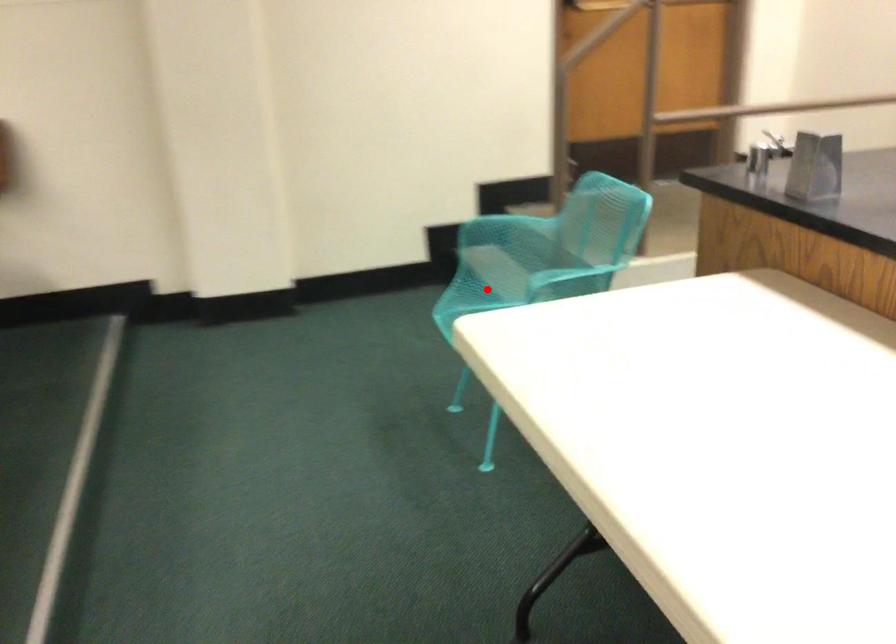
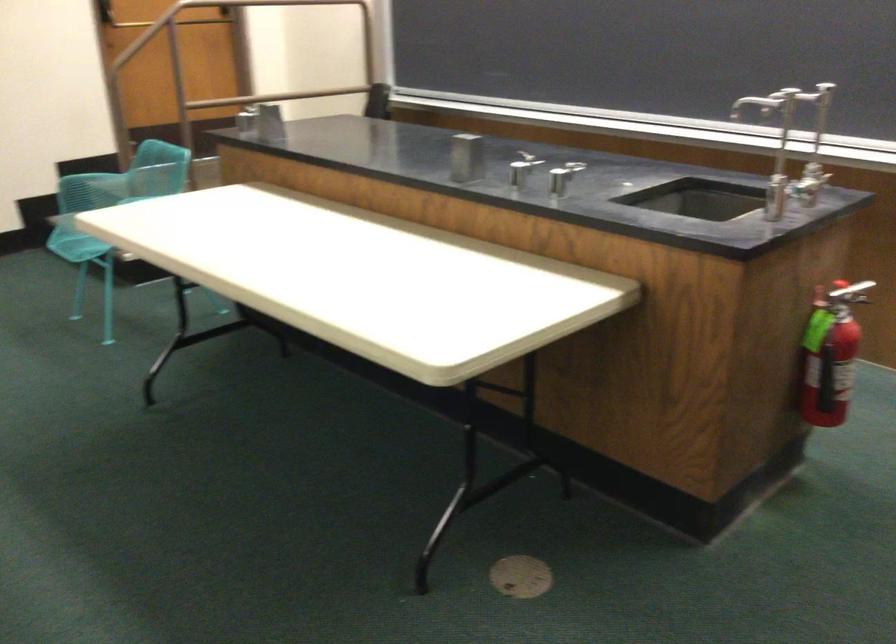
Question: I am providing you with two images of the same scene from different viewpoints. A red point is marked on the first image. At the location where the point appears in image 1, is it still visible in image 2?

Choices:
 (A) Yes
 (B) No

Answer: (B)